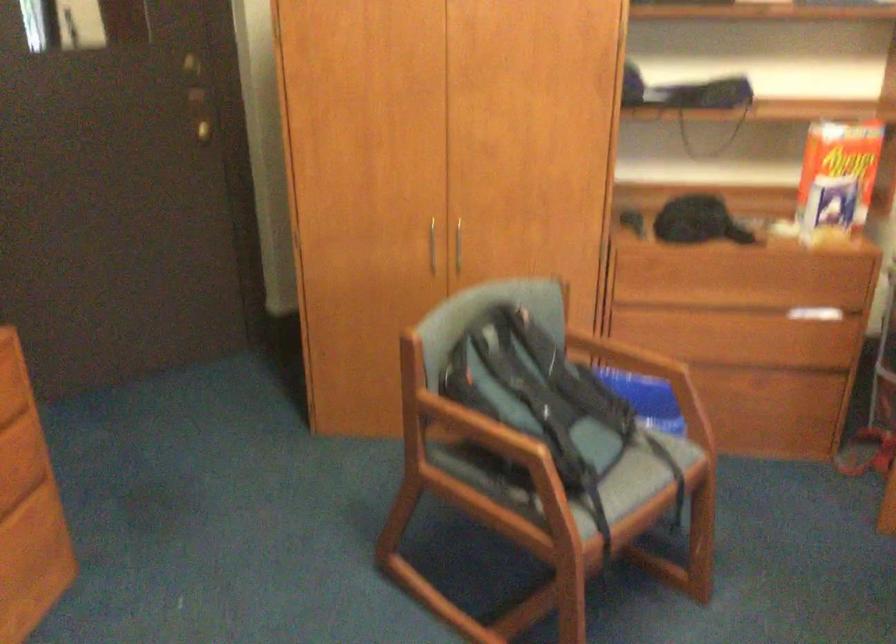
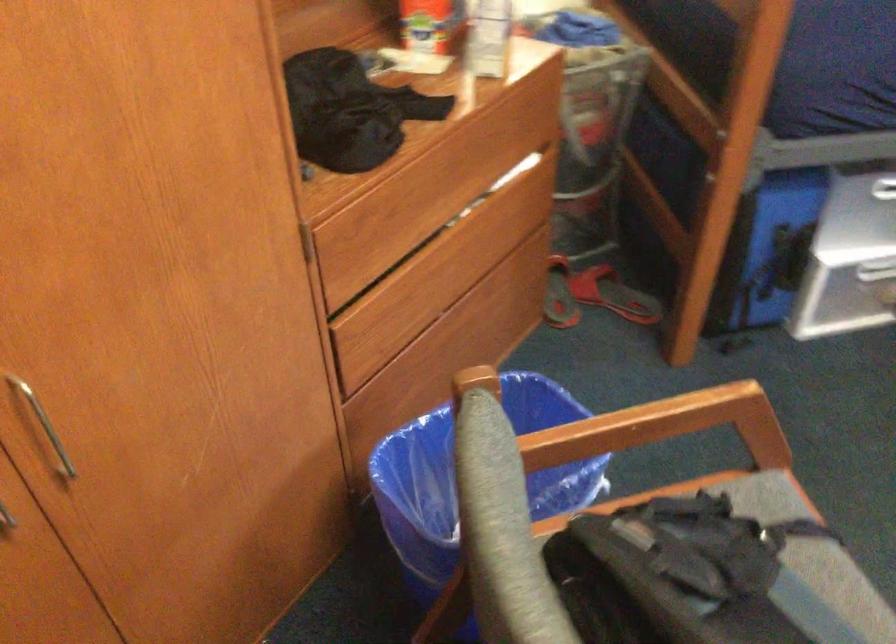
Find the pixel in the second image that matches pixel 522 294 in the first image.

(487, 460)